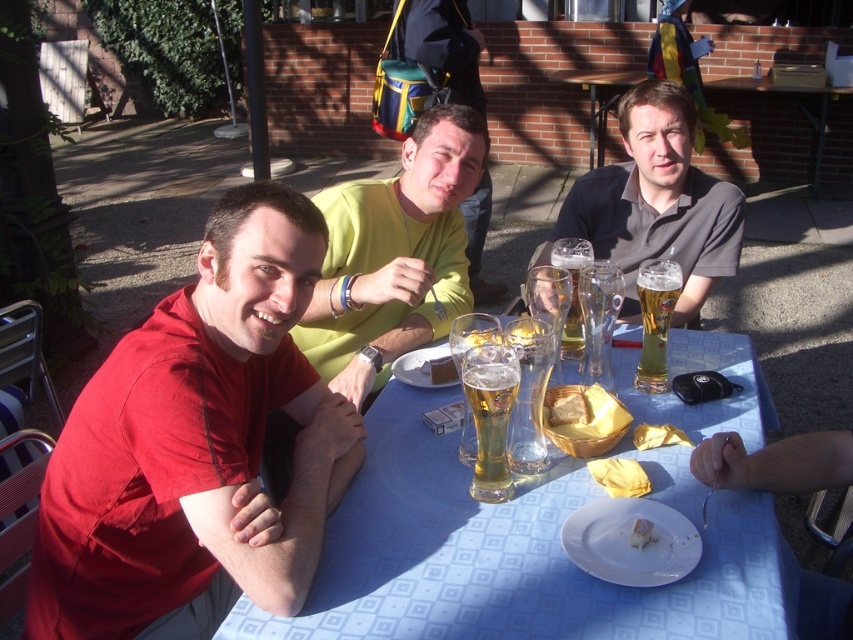
Identify the location of yellow paper napkin at table center. (567, 410).

Which is in front, point (564, 401) or point (428, 365)?

Point (564, 401) is in front.

Is point (560, 419) behind point (440, 376)?

No, (560, 419) is in front of (440, 376).

The height and width of the screenshot is (640, 853). What are the coordinates of `yellow paper napkin at table center` in the screenshot? It's located at (567, 410).

Which is below, matte red shirt at left or translucent glass at table center?

Positioned lower is matte red shirt at left.

Does matte red shirt at left come in front of translucent glass at table center?

Yes, it is.

What are the coordinates of `matte red shirt at left` in the screenshot? It's located at (196, 445).

Can you confirm if blue fabric table at center is positioned below translucent glass beer at center?

Yes, blue fabric table at center is below translucent glass beer at center.

Does blue fabric table at center have a lesser width compared to translucent glass beer at center?

Incorrect, blue fabric table at center's width is not less than translucent glass beer at center's.

Between point (486, 588) and point (566, 259), which one is positioned behind?

The point (566, 259) is behind.

Locate an element on the screen. Image resolution: width=853 pixels, height=640 pixels. blue fabric table at center is located at coordinates (508, 556).